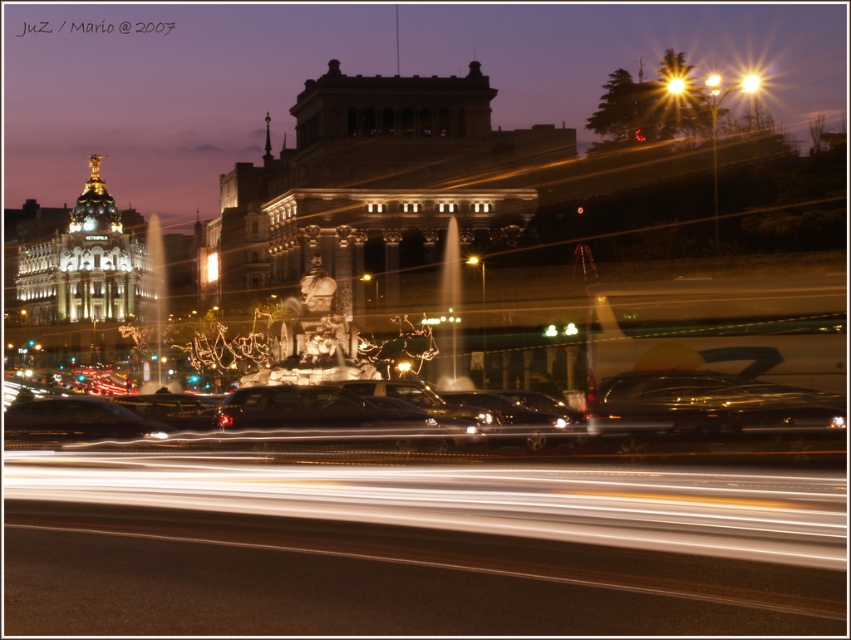
Question: Which of the following is the farthest from the observer?

Choices:
 (A) shiny black car at right
 (B) bright yellow streetlight at upper right
 (C) shiny black car at center

Answer: (B)

Question: Can you confirm if shiny black car at center is bigger than bright yellow streetlight at upper center?

Choices:
 (A) yes
 (B) no

Answer: (B)

Question: Does shiny black car at right have a lesser width compared to bright yellow light at upper center?

Choices:
 (A) yes
 (B) no

Answer: (B)

Question: Among these objects, which one is nearest to the camera?

Choices:
 (A) gold metallic bell tower at upper left
 (B) bright yellow streetlight at upper center

Answer: (B)

Question: Does bright yellow streetlight at upper center have a larger size compared to yellow glass streetlight at center?

Choices:
 (A) yes
 (B) no

Answer: (A)

Question: Which point appears farthest from the camera in this image?

Choices:
 (A) (707, 76)
 (B) (664, 401)
 (C) (683, 83)
 (D) (757, 83)

Answer: (A)